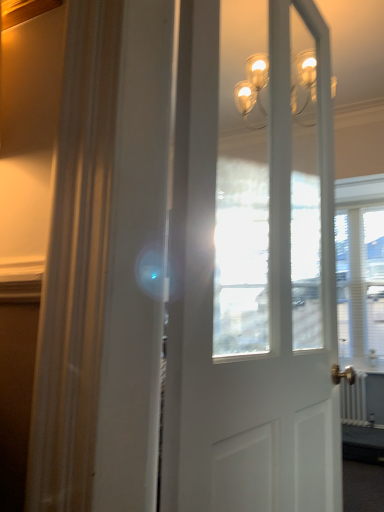
Find the location of `white glossy door at center`. white glossy door at center is located at coordinates (252, 276).

This screenshot has height=512, width=384. What do you see at coordinates (252, 276) in the screenshot?
I see `white glossy door at center` at bounding box center [252, 276].

Where is `white glossy door at center`? This screenshot has height=512, width=384. white glossy door at center is located at coordinates (252, 276).